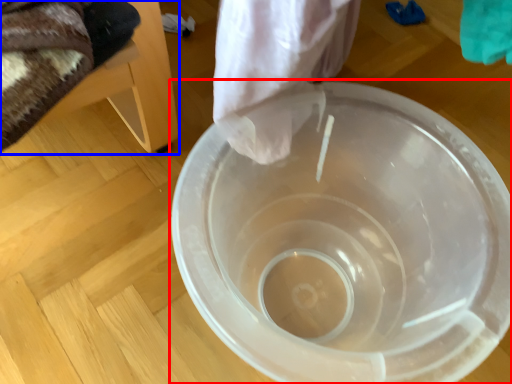
Question: Which of the following is the farthest to the observer, toilet (highlighted by a red box) or furniture (highlighted by a blue box)?

Choices:
 (A) toilet
 (B) furniture

Answer: (A)